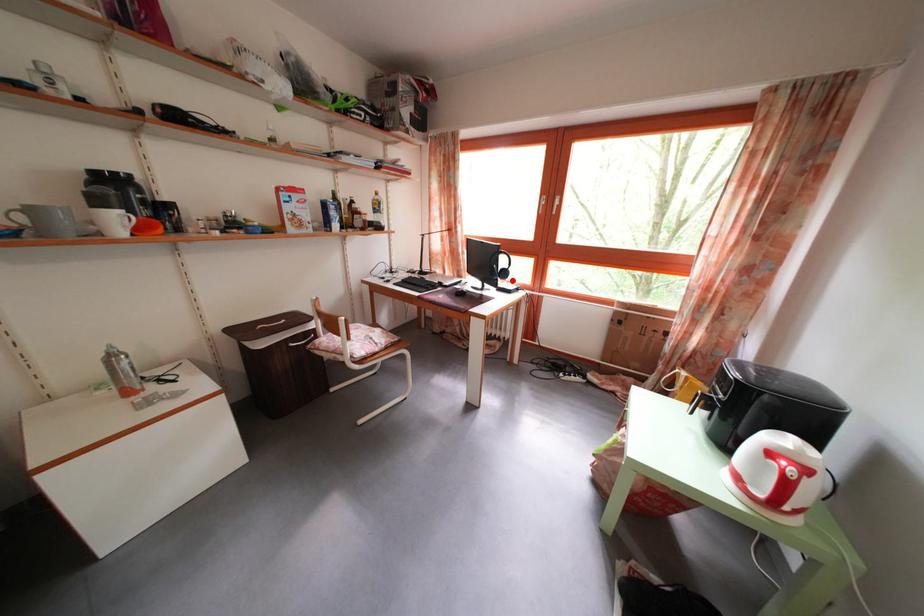
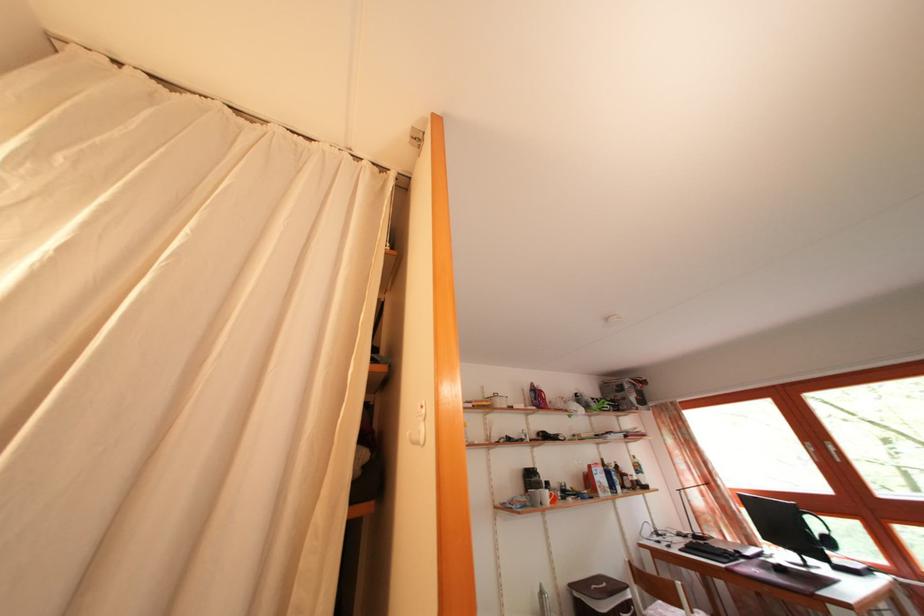
Where in the second image is the point corresponding to the highlighted location from the first image?

(837, 549)